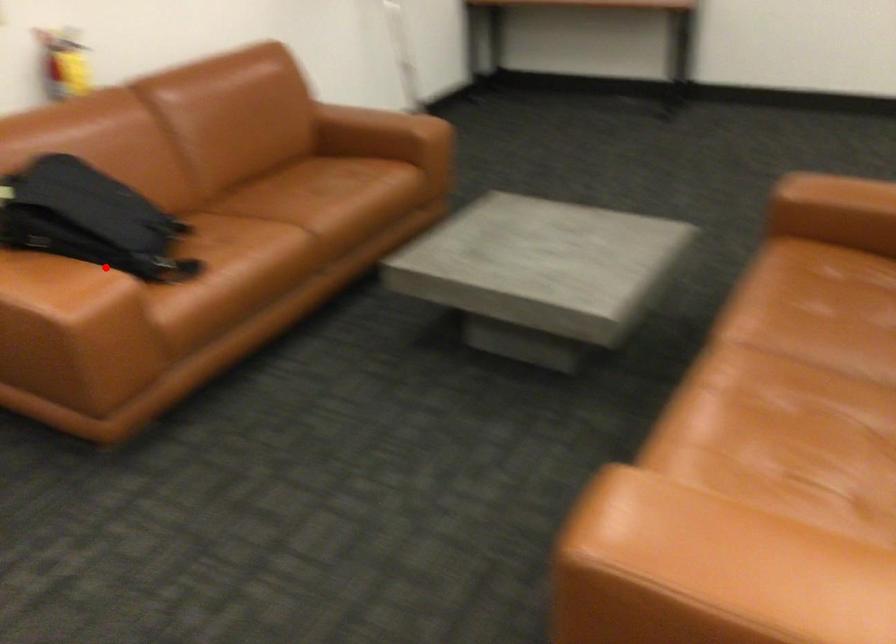
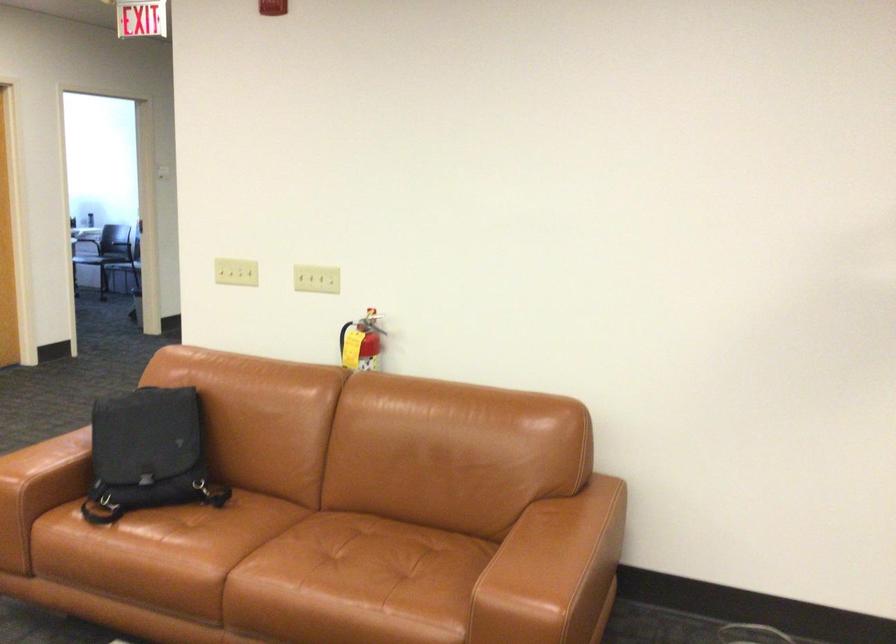
The point at the highlighted location is marked in the first image. Where is the corresponding point in the second image?

(49, 467)